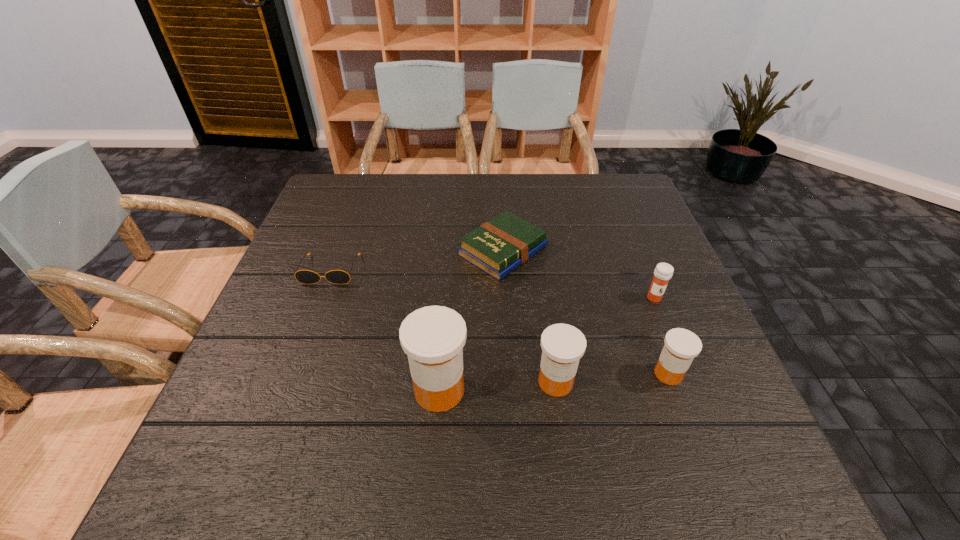
Considering the uniform spacing of medicines, where should an additional medicine be positioned on the left? Please locate a free spot. Please provide its 2D coordinates. Your answer should be formatted as a tuple, i.e. [(x, y)], where the tuple contains the x and y coordinates of a point satisfying the conditions above.

[(319, 399)]